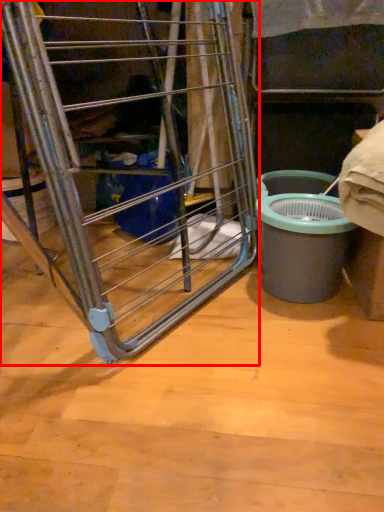
Question: In this image, where is ladder (annotated by the red box) located relative to waste container?

Choices:
 (A) left
 (B) right

Answer: (A)